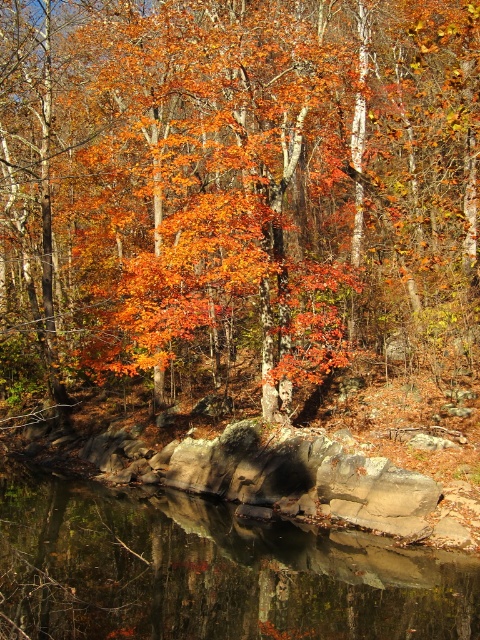
Question: Is orange leafy tree at center wider than smooth reflective water at center?

Choices:
 (A) yes
 (B) no

Answer: (A)

Question: Which object appears closest to the camera in this image?

Choices:
 (A) orange leafy tree at center
 (B) smooth reflective water at center

Answer: (B)

Question: Which object is farther from the camera taking this photo?

Choices:
 (A) orange leafy tree at center
 (B) smooth reflective water at center

Answer: (A)

Question: Does orange leafy tree at center have a larger size compared to smooth reflective water at center?

Choices:
 (A) yes
 (B) no

Answer: (A)

Question: Is orange leafy tree at center positioned at the back of smooth reflective water at center?

Choices:
 (A) yes
 (B) no

Answer: (A)

Question: Which object appears farthest from the camera in this image?

Choices:
 (A) orange leafy tree at center
 (B) smooth reflective water at center

Answer: (A)